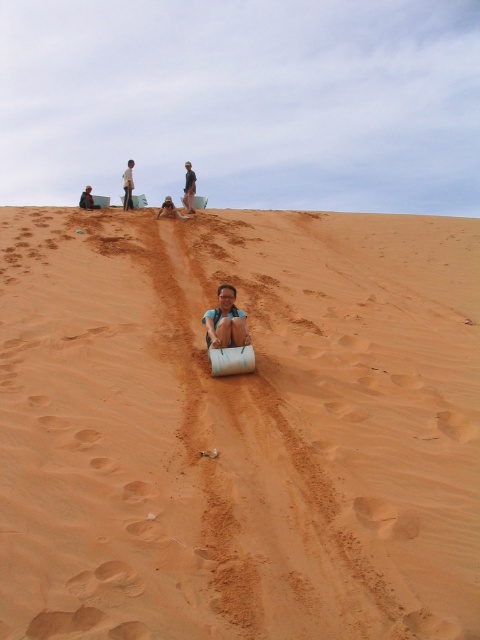
You are planning to place a 3 meter long safety net between the green fabric shirt at center and the light brown sand at upper center to catch someone sliding down. Will the safety net be long enough?

A: The distance between the green fabric shirt at center and the light brown sand at upper center is 3.38 meters. Since the safety net is only 3 meters long, it will not be long enough to cover the entire distance.

Looking at the sandy dune landscape, where is the matte brown sand at center located in relation to the light brown sand at upper center?

The matte brown sand at center is to the right of the light brown sand at upper center.